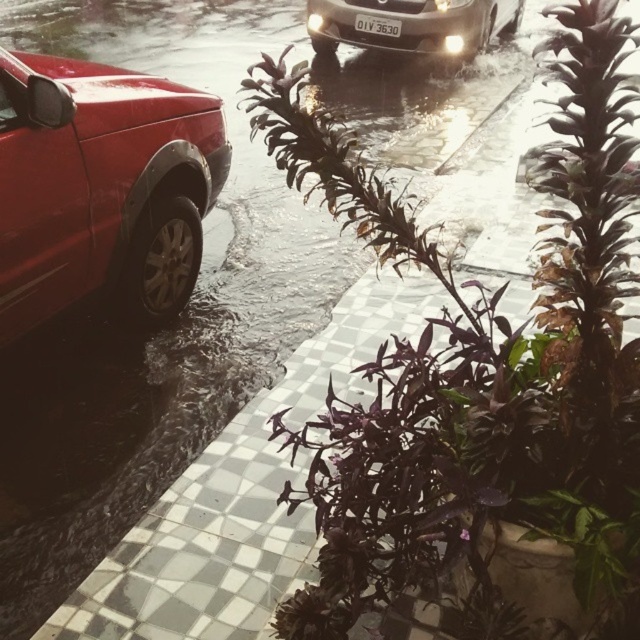
You are a tow truck operator assessing the flooded street scene. You see the sleek silver sedan at upper center and the white plastic license plate at center. Which object would you need to measure to determine if the tow truck can safely pass through the flooded area?

You would need to measure the width of the sleek silver sedan at upper center because the license plate is just a part of the vehicle and its width is not relevant to the tow truck passing through safely.

You are standing at the point marked as point [477,362] in the image. What object are you standing on?

You are standing on the purple matte plant at center.